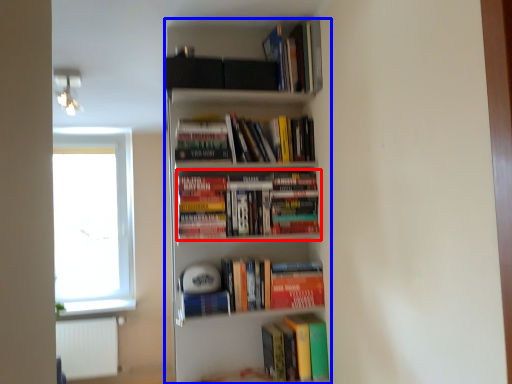
Question: Which object appears farthest to the camera in this image, book (highlighted by a red box) or bookcase (highlighted by a blue box)?

Choices:
 (A) book
 (B) bookcase

Answer: (A)